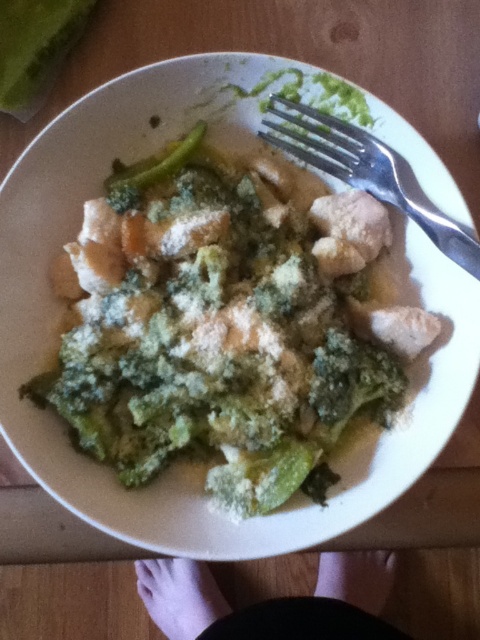
You are a food critic evaluating this dish. You need to describe the arrangement of the white powdery chicken at center and the green crumbly broccoli at center. Which one is placed to the left?

The white powdery chicken at center is positioned on the left side of green crumbly broccoli at center, so the white powdery chicken at center is placed to the left.

In the scene shown: You are a food critic evaluating this dish. You need to determine if the silver metallic fork at upper right can be used to easily pick up the green leafy vegetable at center without it slipping through the tines. Based on their sizes, what do you think?

The silver metallic fork at upper right has a larger size compared to green leafy vegetable at center, so it should be able to hold the green leafy vegetable at center securely without slipping through the tines.

You are a food critic evaluating the presentation of the dish. The plate has a pink fabric feet at lower center and a silver metallic fork at upper right. Which object is shorter in height?

The pink fabric feet at lower center has a lesser height compared to the silver metallic fork at upper right, so the pink fabric feet at lower center is shorter in height.